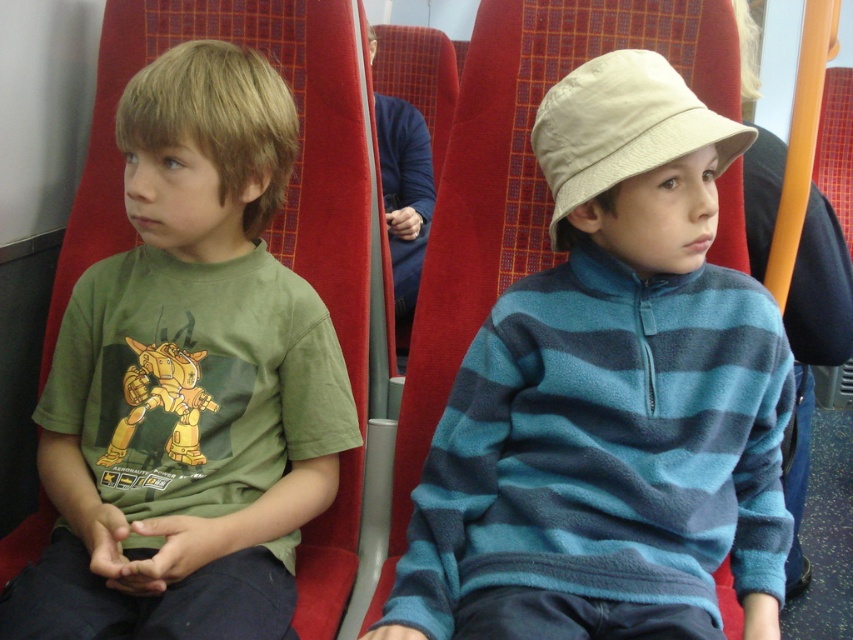
Who is taller, blue striped fleece at center or green cotton shirt at left?

green cotton shirt at left

Is blue striped fleece at center positioned at the back of green cotton shirt at left?

No, blue striped fleece at center is closer to the viewer.

This screenshot has width=853, height=640. I want to click on blue striped fleece at center, so click(x=610, y=400).

Can you confirm if blue striped fleece at center is positioned below beige fabric hat at center?

Indeed, blue striped fleece at center is positioned under beige fabric hat at center.

Describe the element at coordinates (610, 400) in the screenshot. The width and height of the screenshot is (853, 640). I see `blue striped fleece at center` at that location.

This screenshot has width=853, height=640. What do you see at coordinates (610, 400) in the screenshot? I see `blue striped fleece at center` at bounding box center [610, 400].

Identify the location of blue striped fleece at center. (610, 400).

Does green cotton shirt at left have a greater width compared to beige fabric hat at center?

Yes, green cotton shirt at left is wider than beige fabric hat at center.

Between green cotton shirt at left and beige fabric hat at center, which one is positioned lower?

green cotton shirt at left is lower down.

Between point (144, 625) and point (561, 109), which one is positioned behind?

The point (561, 109) is behind.

The height and width of the screenshot is (640, 853). I want to click on green cotton shirt at left, so click(187, 380).